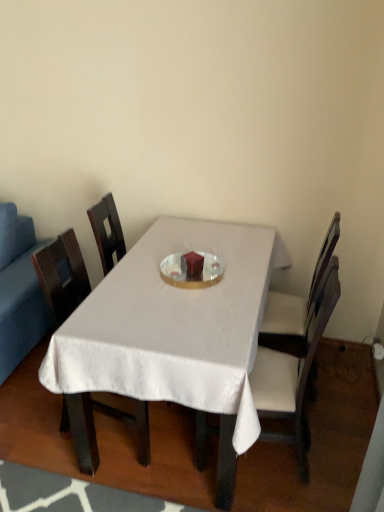
Question: Is white satin table at center wider than white fabric chair at center, arranged as the 3th chair when viewed from the left?

Choices:
 (A) yes
 (B) no

Answer: (A)

Question: Is white satin table at center smaller than white fabric chair at center, arranged as the 3th chair when viewed from the left?

Choices:
 (A) yes
 (B) no

Answer: (B)

Question: From a real-world perspective, does white satin table at center sit lower than white fabric chair at center, which is counted as the first chair, starting from the right?

Choices:
 (A) yes
 (B) no

Answer: (A)

Question: Are white satin table at center and white fabric chair at center, which is counted as the first chair, starting from the right, beside each other?

Choices:
 (A) no
 (B) yes

Answer: (A)

Question: Does white satin table at center have a lesser width compared to white fabric chair at center, which is counted as the first chair, starting from the right?

Choices:
 (A) no
 (B) yes

Answer: (A)

Question: Is white fabric chair at center, which is counted as the first chair, starting from the right, located within white satin table at center?

Choices:
 (A) no
 (B) yes

Answer: (B)

Question: Can you confirm if white fabric chair at center, which is counted as the first chair, starting from the right, is thinner than wooden chair at center, which is the 3th chair from right to left?

Choices:
 (A) yes
 (B) no

Answer: (A)

Question: Is white fabric chair at center, which is counted as the first chair, starting from the right, facing away from wooden chair at center, marked as the first chair in a left-to-right arrangement?

Choices:
 (A) yes
 (B) no

Answer: (B)

Question: Does white fabric chair at center, arranged as the 3th chair when viewed from the left, have a greater width compared to wooden chair at center, which is the 3th chair from right to left?

Choices:
 (A) no
 (B) yes

Answer: (A)

Question: Is the surface of white fabric chair at center, arranged as the 3th chair when viewed from the left, in direct contact with wooden chair at center, marked as the first chair in a left-to-right arrangement?

Choices:
 (A) no
 (B) yes

Answer: (A)

Question: Can you confirm if white fabric chair at center, which is counted as the first chair, starting from the right, is taller than wooden chair at center, marked as the first chair in a left-to-right arrangement?

Choices:
 (A) no
 (B) yes

Answer: (B)

Question: Can you confirm if white fabric chair at center, which is counted as the first chair, starting from the right, is positioned to the left of wooden chair at center, marked as the first chair in a left-to-right arrangement?

Choices:
 (A) yes
 (B) no

Answer: (B)

Question: Considering the relative positions of white fabric chair at center, the second chair from the right, and white satin table at center in the image provided, is white fabric chair at center, the second chair from the right, in front of white satin table at center?

Choices:
 (A) no
 (B) yes

Answer: (A)